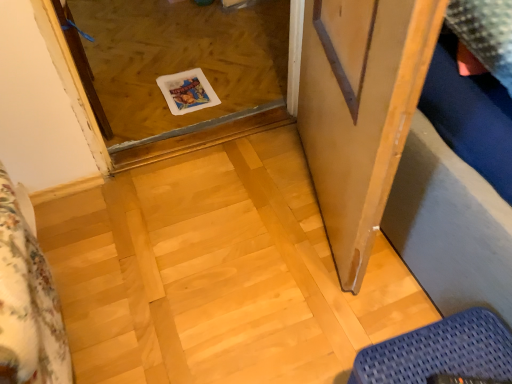
Question: Is blue woven mat at lower right bigger than transparent glass door at center?

Choices:
 (A) yes
 (B) no

Answer: (B)

Question: Is blue woven mat at lower right not inside transparent glass door at center?

Choices:
 (A) no
 (B) yes

Answer: (B)

Question: Is blue woven mat at lower right closer to the viewer compared to transparent glass door at center?

Choices:
 (A) yes
 (B) no

Answer: (A)

Question: From a real-world perspective, is blue woven mat at lower right positioned over transparent glass door at center based on gravity?

Choices:
 (A) yes
 (B) no

Answer: (A)

Question: Is blue woven mat at lower right oriented away from transparent glass door at center?

Choices:
 (A) no
 (B) yes

Answer: (A)

Question: From the image's perspective, is blue woven mat at lower right below transparent glass door at center?

Choices:
 (A) no
 (B) yes

Answer: (B)

Question: Is blue woven mat at lower right facing towards wooden screen door at right?

Choices:
 (A) no
 (B) yes

Answer: (A)

Question: Does blue woven mat at lower right have a lesser height compared to wooden screen door at right?

Choices:
 (A) yes
 (B) no

Answer: (A)

Question: From a real-world perspective, is blue woven mat at lower right physically below wooden screen door at right?

Choices:
 (A) no
 (B) yes

Answer: (B)

Question: Considering the relative positions of blue woven mat at lower right and wooden screen door at right in the image provided, is blue woven mat at lower right in front of wooden screen door at right?

Choices:
 (A) no
 (B) yes

Answer: (A)

Question: From a real-world perspective, is blue woven mat at lower right physically above wooden screen door at right?

Choices:
 (A) yes
 (B) no

Answer: (B)

Question: Does blue woven mat at lower right have a smaller size compared to wooden screen door at right?

Choices:
 (A) no
 (B) yes

Answer: (B)

Question: Considering the relative sizes of transparent glass door at center and blue woven mat at lower right in the image provided, is transparent glass door at center bigger than blue woven mat at lower right?

Choices:
 (A) yes
 (B) no

Answer: (A)